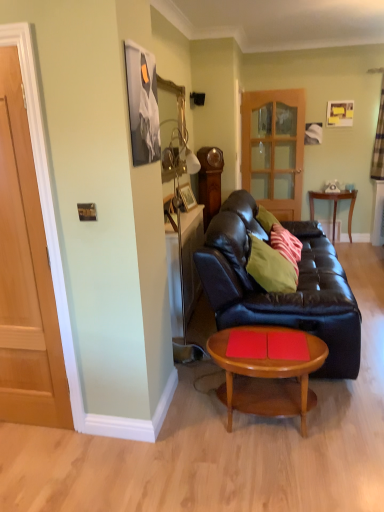
Identify the location of vacant area that lies to the right of light brown wooden coffee table at center. (349, 418).